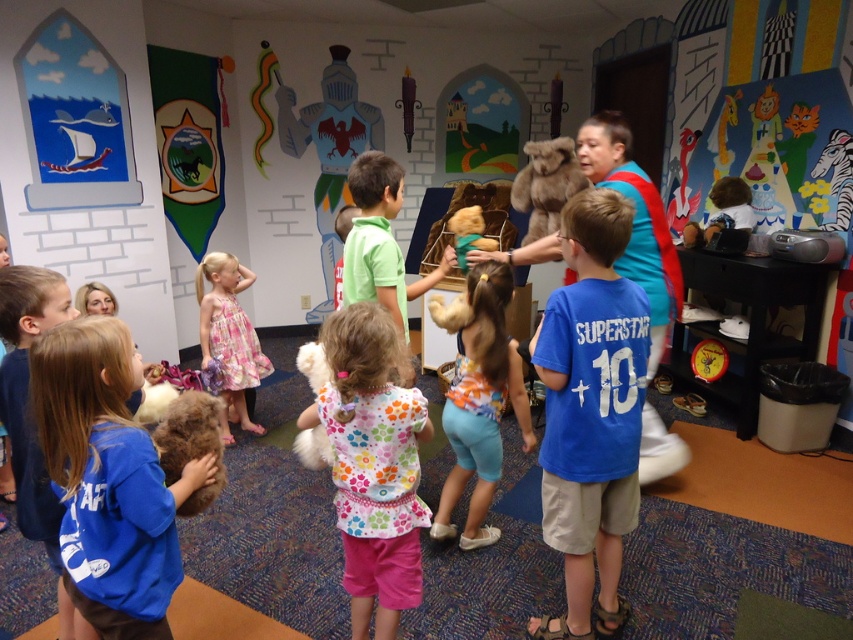
You are a child standing in the classroom and want to reach both the gray metallic knight at center and the fuzzy brown teddy bear at lower left. Which object will you need to walk towards first if you want to pick up the one closer to you?

You should pick up the gray metallic knight at center first because it is closer to you than the fuzzy brown teddy bear at lower left.

You are a parent looking for your child in a classroom. You see the fluffy brown teddy bear at center and the green cotton shirt at center. Which object is closer to you?

The fluffy brown teddy bear at center is closer to you because the green cotton shirt at center is behind it.

You are a child trying to decide which item to take from the table. The fluffy brown teddy bear at center and the green cotton shirt at center are both on the table. Which one is taller?

The fluffy brown teddy bear at center is taller than the green cotton shirt at center.